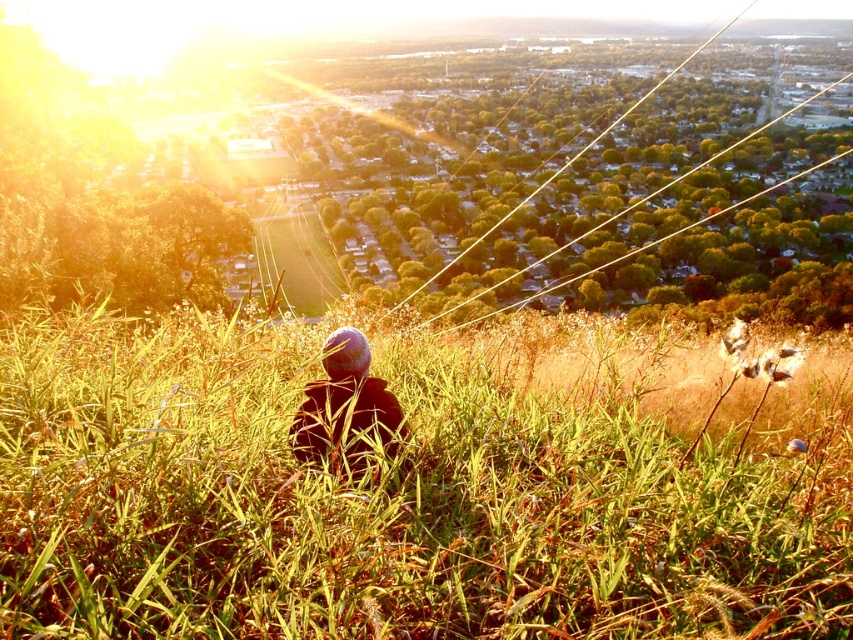
You are a photographer trying to capture the scene from the same vantage point as the person sitting on the hill. You notice the green grassy at center and the dark fabric hat at center. Which object is closer to the ground?

The green grassy at center is below dark fabric hat at center, so it is closer to the ground.

You are standing on the grassy hill and want to place a small picnic basket between the green grassy at center and the dark fabric hat at center. Based on their positions, which object should you place the basket closer to if you want it to be on the left side of the hat?

The green grassy at center is to the right of the dark fabric hat at center. To place the picnic basket on the left side of the hat, you should position it closer to the dark fabric hat at center since the hat is on the left, and the grassy area is to its right.